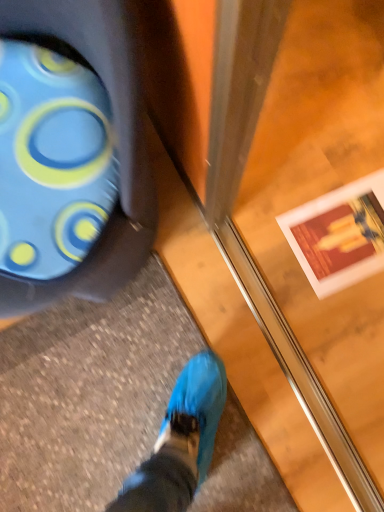
At what (x,y) coordinates should I click in order to perform the action: click on spots to the right of transparent glass screen door at center. Please return your answer as a coordinate pair (x, y). This screenshot has width=384, height=512. Looking at the image, I should click on (329, 273).